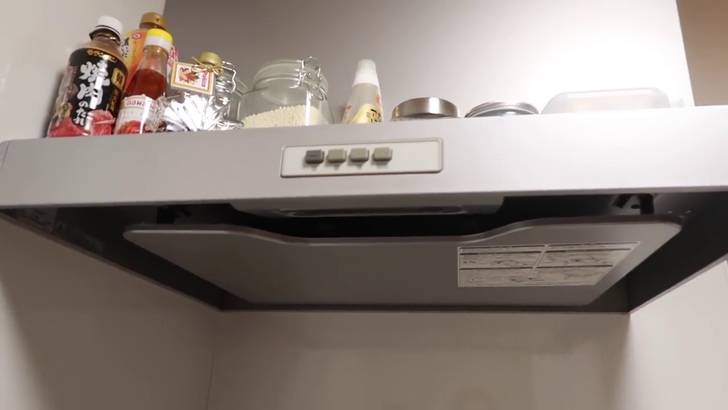
Find the location of a particular element. The image size is (728, 410). plastic lid is located at coordinates (108, 21), (146, 18), (159, 34), (205, 53), (363, 63).